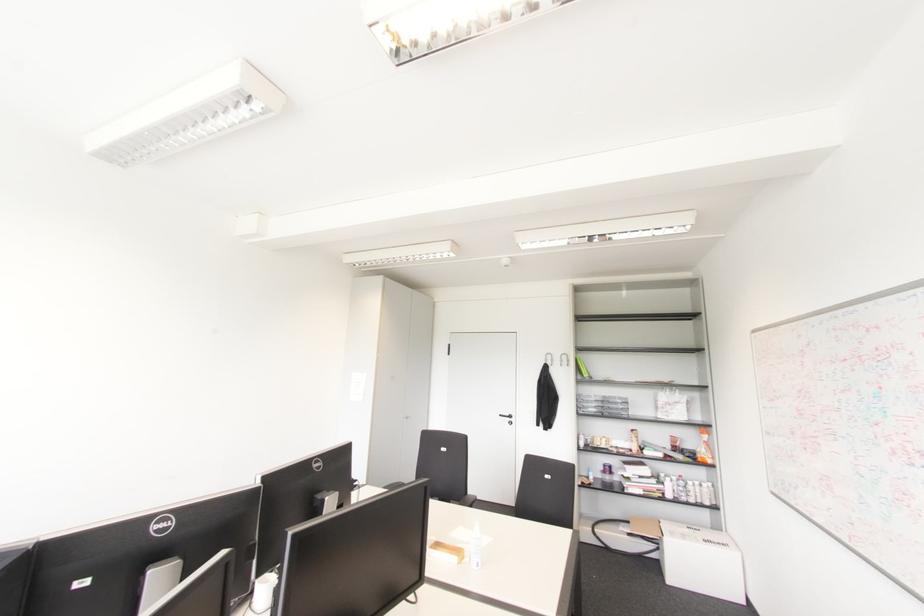
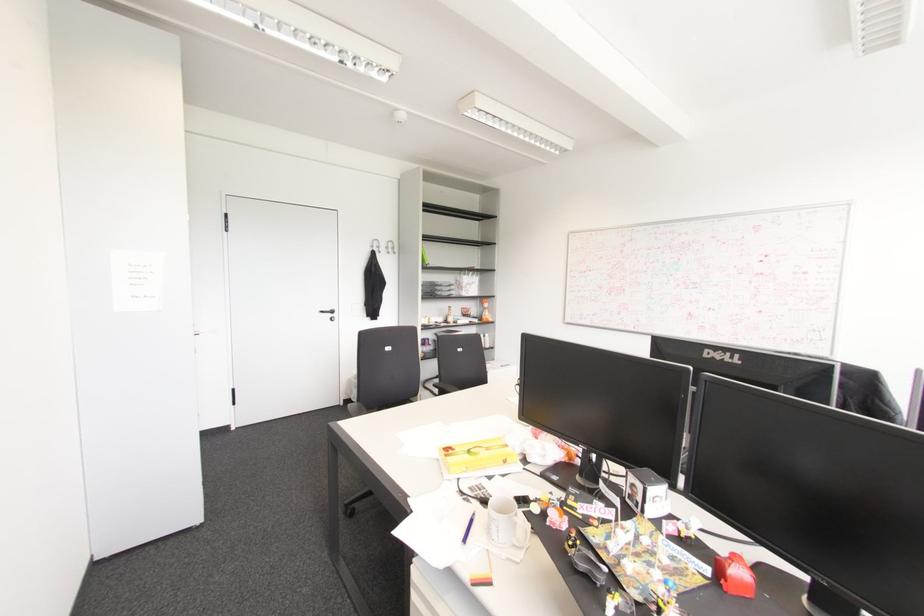
Where in the second image is the point corresponding to point 509,416 from the first image?

(332, 310)